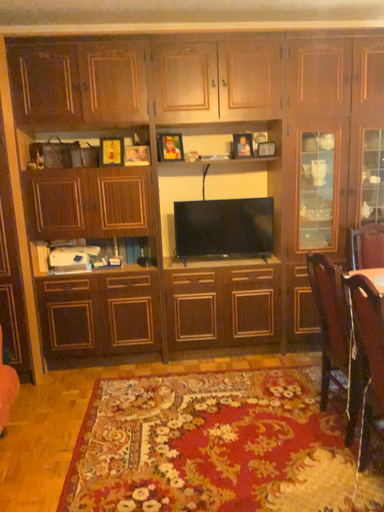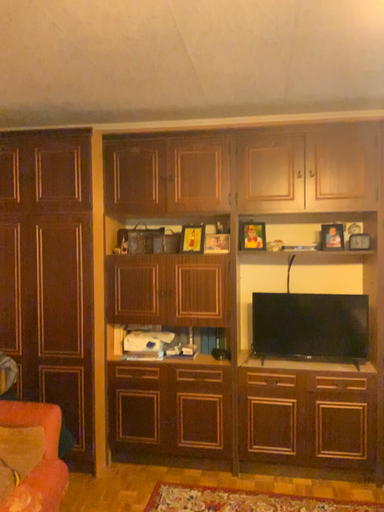
Question: Which way did the camera rotate in the video?

Choices:
 (A) rotated right
 (B) rotated left

Answer: (B)